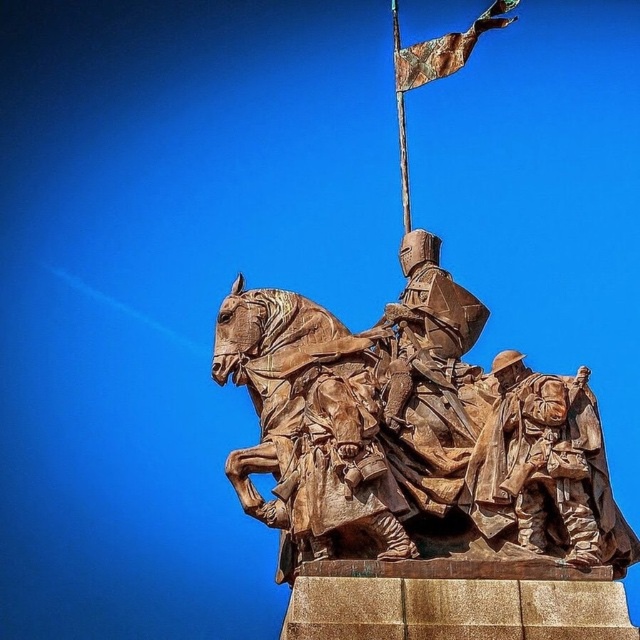
Question: Can you confirm if bronze statue at center is positioned to the left of rustic bronze horse at center?

Choices:
 (A) yes
 (B) no

Answer: (B)

Question: Which point is closer to the camera taking this photo?

Choices:
 (A) (340, 496)
 (B) (483, 438)
 (C) (432, 337)

Answer: (A)

Question: Which of the following is the farthest from the observer?

Choices:
 (A) click(408, 81)
 (B) click(502, 544)

Answer: (A)

Question: Does bronze statue at center lie in front of rustic bronze horse at center?

Choices:
 (A) yes
 (B) no

Answer: (A)

Question: Does bronze statue at center lie in front of rustic bronze soldiers at lower right?

Choices:
 (A) yes
 (B) no

Answer: (A)

Question: Among these objects, which one is nearest to the camera?

Choices:
 (A) bronze statue at center
 (B) rustic bronze horse at center

Answer: (A)